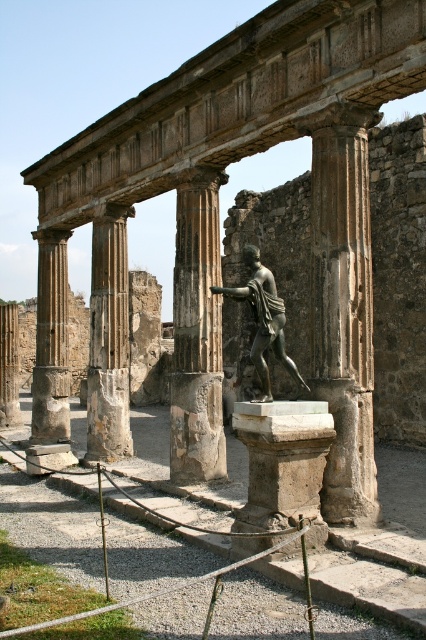
You are an archaeologist examining the ancient structure. You notice the stone column at center and the bronze statue at center. Which object would cast a larger shadow at noon when the sun is directly overhead?

The stone column at center is bigger than the bronze statue at center, so it would cast a larger shadow at noon when the sun is directly overhead.